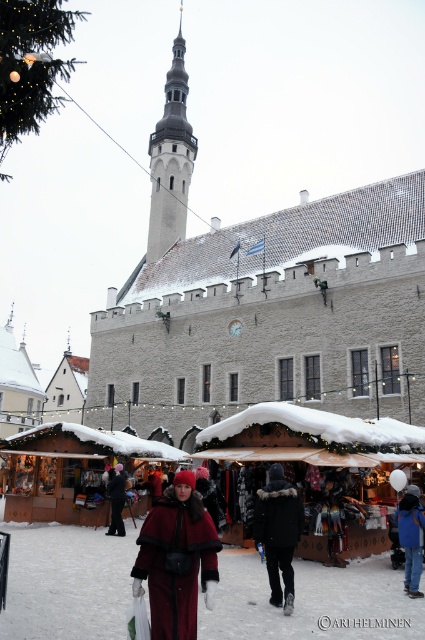
Is black fur-trimmed coat at center further to the viewer compared to dark blue jacket at lower right?

No, black fur-trimmed coat at center is closer to the viewer.

Consider the image. Is black fur-trimmed coat at center smaller than dark blue jacket at lower right?

Yes.

Measure the distance between point (295, 540) and camera.

The distance of point (295, 540) from camera is 30.33 meters.

Locate an element on the screen. Image resolution: width=425 pixels, height=640 pixels. black fur-trimmed coat at center is located at coordinates (278, 532).

The height and width of the screenshot is (640, 425). I want to click on velvet red coat at center, so click(x=176, y=557).

Locate an element on the screen. This screenshot has height=640, width=425. velvet red coat at center is located at coordinates (176, 557).

Is black fur-trimmed coat at center to the left of black matte coat at lower left from the viewer's perspective?

Incorrect, black fur-trimmed coat at center is not on the left side of black matte coat at lower left.

From the picture: Between black fur-trimmed coat at center and black matte coat at lower left, which one is positioned lower?

black matte coat at lower left is lower down.

Is point (300, 522) farther from viewer compared to point (121, 474)?

No, it is in front of (121, 474).

The height and width of the screenshot is (640, 425). In order to click on black fur-trimmed coat at center in this screenshot , I will do `click(278, 532)`.